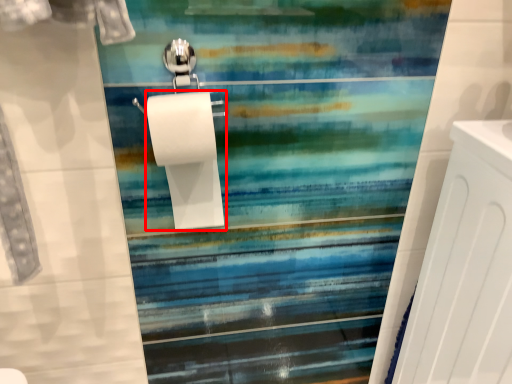
Question: From the image's perspective, where is toilet paper (annotated by the red box) located in relation to radiator in the image?

Choices:
 (A) above
 (B) below

Answer: (A)